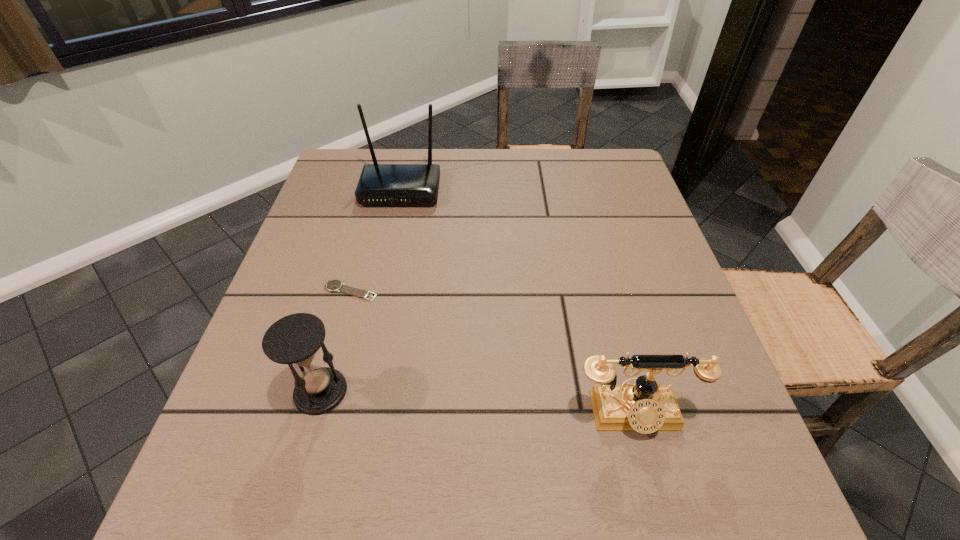
In order to click on the farthest object in this screenshot , I will do `click(379, 184)`.

Locate an element on the screen. The image size is (960, 540). router is located at coordinates (379, 184).

Where is `hourglass`? hourglass is located at coordinates coord(295,339).

What are the coordinates of `telephone` in the screenshot? It's located at (645, 407).

At what (x,y) coordinates should I click in order to perform the action: click on the shortest object. Please return your answer as a coordinate pair (x, y). This screenshot has height=540, width=960. Looking at the image, I should click on (332, 285).

The width and height of the screenshot is (960, 540). What are the coordinates of `the second farthest object` in the screenshot? It's located at (332, 285).

The width and height of the screenshot is (960, 540). I want to click on vacant space situated 0.180m on the front-facing side of the farthest object, so click(386, 258).

This screenshot has height=540, width=960. What are the coordinates of `vacant space located 0.380m on the right of the hourglass` in the screenshot? It's located at (571, 392).

Locate an element on the screen. The height and width of the screenshot is (540, 960). vacant space situated on the right of the watch is located at coordinates (466, 292).

Identify the location of object at the far edge. (379, 184).